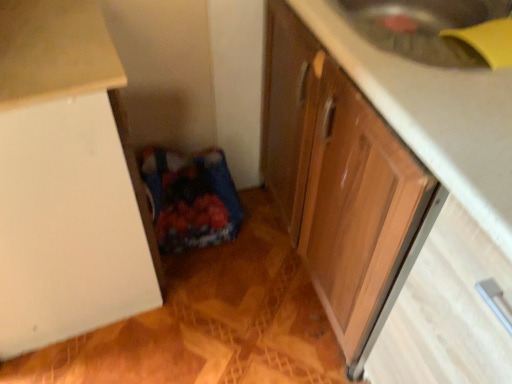
Question: Can you confirm if wooden drawer at lower right is wider than wooden cabinet at lower right, acting as the 2th cabinetry starting from the left?

Choices:
 (A) no
 (B) yes

Answer: (A)

Question: Does wooden drawer at lower right appear on the right side of wooden cabinet at lower right, acting as the 1th cabinetry starting from the right?

Choices:
 (A) no
 (B) yes

Answer: (B)

Question: Is the depth of wooden drawer at lower right greater than that of wooden cabinet at lower right, acting as the 1th cabinetry starting from the right?

Choices:
 (A) yes
 (B) no

Answer: (A)

Question: Is wooden drawer at lower right in front of wooden cabinet at lower right, acting as the 2th cabinetry starting from the left?

Choices:
 (A) no
 (B) yes

Answer: (A)

Question: From the image's perspective, does wooden drawer at lower right appear higher than wooden cabinet at lower right, acting as the 1th cabinetry starting from the right?

Choices:
 (A) yes
 (B) no

Answer: (B)

Question: From their relative heights in the image, would you say wooden cabinet at lower right, acting as the 1th cabinetry starting from the right, is taller or shorter than wooden drawer at lower right?

Choices:
 (A) tall
 (B) short

Answer: (B)

Question: In the image, is wooden cabinet at lower right, acting as the 2th cabinetry starting from the left, positioned in front of or behind wooden drawer at lower right?

Choices:
 (A) behind
 (B) front

Answer: (B)

Question: Considering the relative positions of wooden cabinet at lower right, acting as the 1th cabinetry starting from the right, and wooden drawer at lower right in the image provided, is wooden cabinet at lower right, acting as the 1th cabinetry starting from the right, to the left or to the right of wooden drawer at lower right?

Choices:
 (A) right
 (B) left

Answer: (B)

Question: In terms of width, does wooden cabinet at lower right, acting as the 2th cabinetry starting from the left, look wider or thinner when compared to wooden drawer at lower right?

Choices:
 (A) wide
 (B) thin

Answer: (A)

Question: Is wooden drawer at lower right spatially inside white matte cabinet at left, the second cabinetry in the right-to-left sequence, or outside of it?

Choices:
 (A) inside
 (B) outside

Answer: (B)

Question: Considering the positions of wooden drawer at lower right and white matte cabinet at left, the second cabinetry in the right-to-left sequence, in the image, is wooden drawer at lower right wider or thinner than white matte cabinet at left, the second cabinetry in the right-to-left sequence,?

Choices:
 (A) thin
 (B) wide

Answer: (B)

Question: From a real-world perspective, is wooden drawer at lower right positioned above or below white matte cabinet at left, which is the 1th cabinetry from left to right?

Choices:
 (A) below
 (B) above

Answer: (A)

Question: Does point (415, 362) appear closer or farther from the camera than point (0, 238)?

Choices:
 (A) closer
 (B) farther

Answer: (A)

Question: Do you think white matte cabinet at left, which is the 1th cabinetry from left to right, is within wooden cabinet at lower right, acting as the 2th cabinetry starting from the left, or outside of it?

Choices:
 (A) inside
 (B) outside

Answer: (B)

Question: Considering the positions of white matte cabinet at left, the second cabinetry in the right-to-left sequence, and wooden cabinet at lower right, acting as the 2th cabinetry starting from the left, in the image, is white matte cabinet at left, the second cabinetry in the right-to-left sequence, taller or shorter than wooden cabinet at lower right, acting as the 2th cabinetry starting from the left,?

Choices:
 (A) short
 (B) tall

Answer: (B)